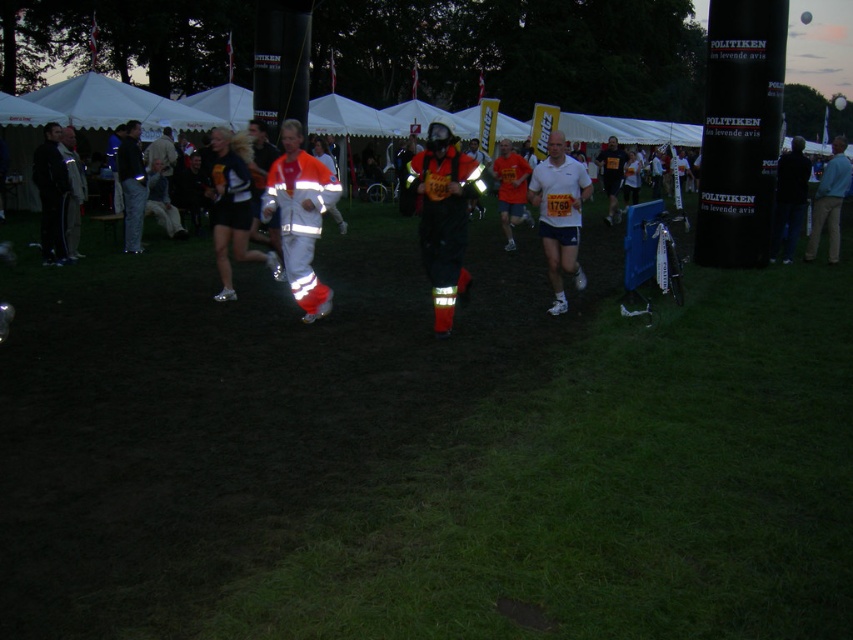
Question: Which point is closer to the camera?

Choices:
 (A) (294, 214)
 (B) (560, 260)

Answer: (A)

Question: Does reflective white santa at center appear on the right side of white matte shirt at center?

Choices:
 (A) no
 (B) yes

Answer: (A)

Question: Which point is closer to the camera?

Choices:
 (A) white matte shirt at center
 (B) reflective white santa at center

Answer: (B)

Question: Does reflective white santa at center appear on the right side of white matte shirt at center?

Choices:
 (A) no
 (B) yes

Answer: (A)

Question: Can you confirm if reflective white santa at center is positioned above white matte shirt at center?

Choices:
 (A) yes
 (B) no

Answer: (B)

Question: Which point appears farthest from the camera in this image?

Choices:
 (A) (323, 166)
 (B) (573, 186)

Answer: (B)